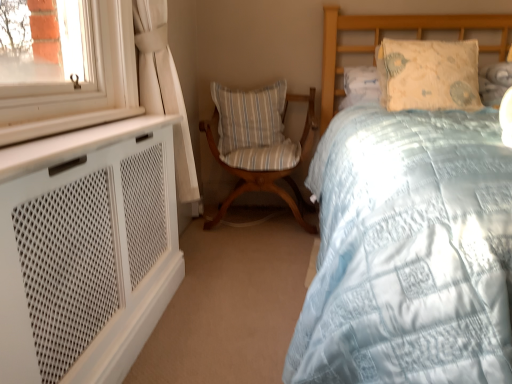
What are the coordinates of `vacant space in front of woodenchair at center` in the screenshot? It's located at (247, 254).